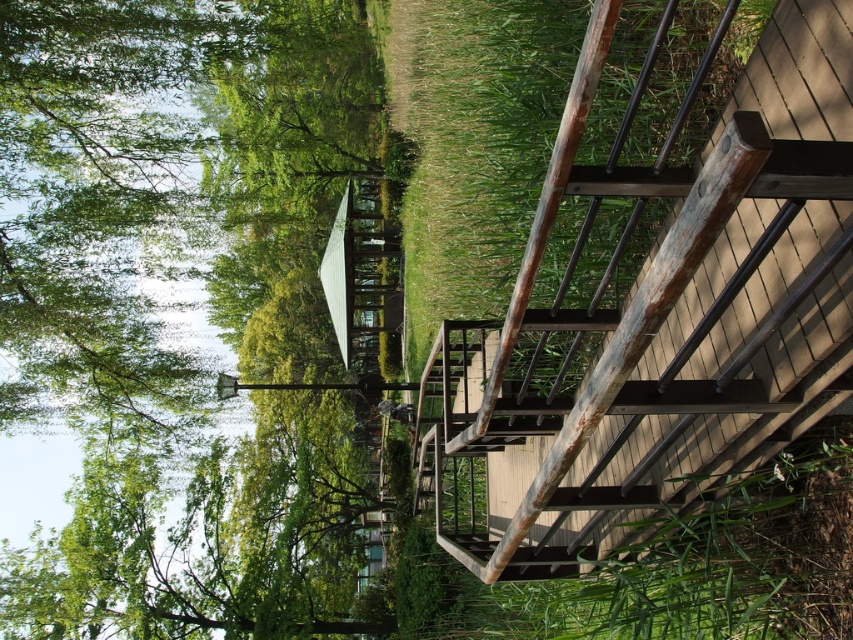
Between point (202, 220) and point (569, 428), which one is positioned behind?

Point (202, 220)

Can you confirm if green leafy tree at upper left is positioned to the left of rustic wood stairwell at upper right?

Correct, you'll find green leafy tree at upper left to the left of rustic wood stairwell at upper right.

I want to click on green leafy tree at upper left, so [x=210, y=305].